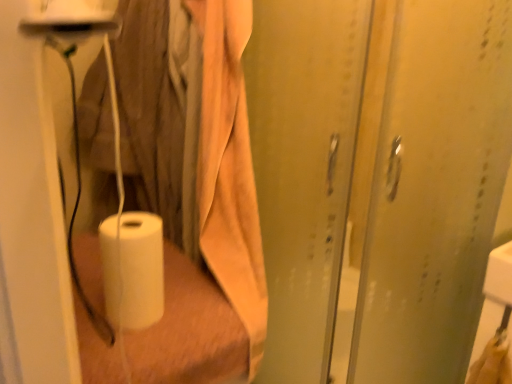
Question: From the image's perspective, is translucent plastic screen door at center, arranged as the second screen door when viewed from the right, positioned above or below transparent plastic screen door at right, which is the second screen door from left to right?

Choices:
 (A) above
 (B) below

Answer: (A)

Question: Is translucent plastic screen door at center, positioned as the first screen door in left-to-right order, to the left or to the right of transparent plastic screen door at right, acting as the 1th screen door starting from the right, in the image?

Choices:
 (A) right
 (B) left

Answer: (B)

Question: Which is nearer to the translucent plastic screen door at center, positioned as the first screen door in left-to-right order?

Choices:
 (A) transparent plastic screen door at right, which is the second screen door from left to right
 (B) white matte paper towel at lower left

Answer: (A)

Question: Estimate the real-world distances between objects in this image. Which object is farther from the transparent plastic screen door at right, which is the second screen door from left to right?

Choices:
 (A) translucent plastic screen door at center, arranged as the second screen door when viewed from the right
 (B) white matte paper towel at lower left

Answer: (B)